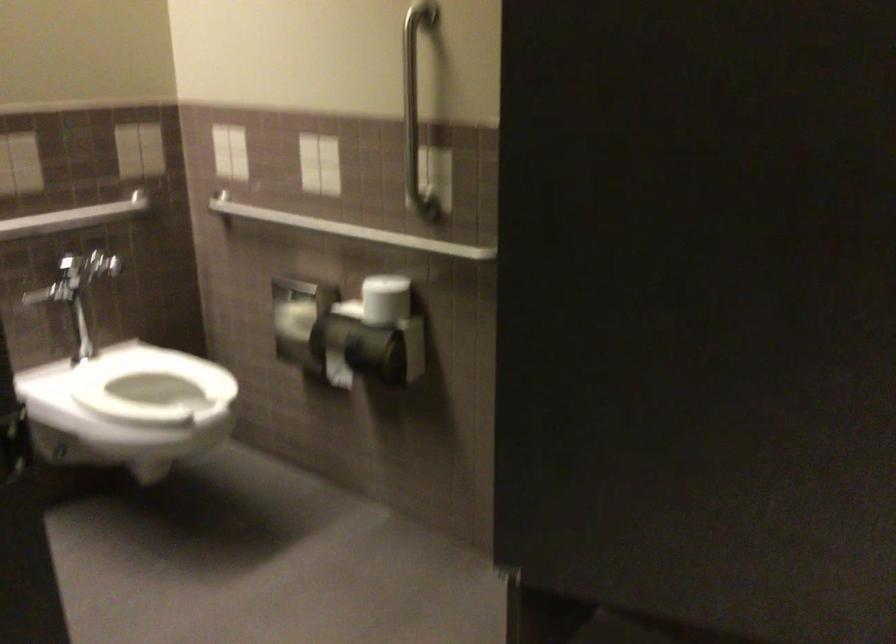
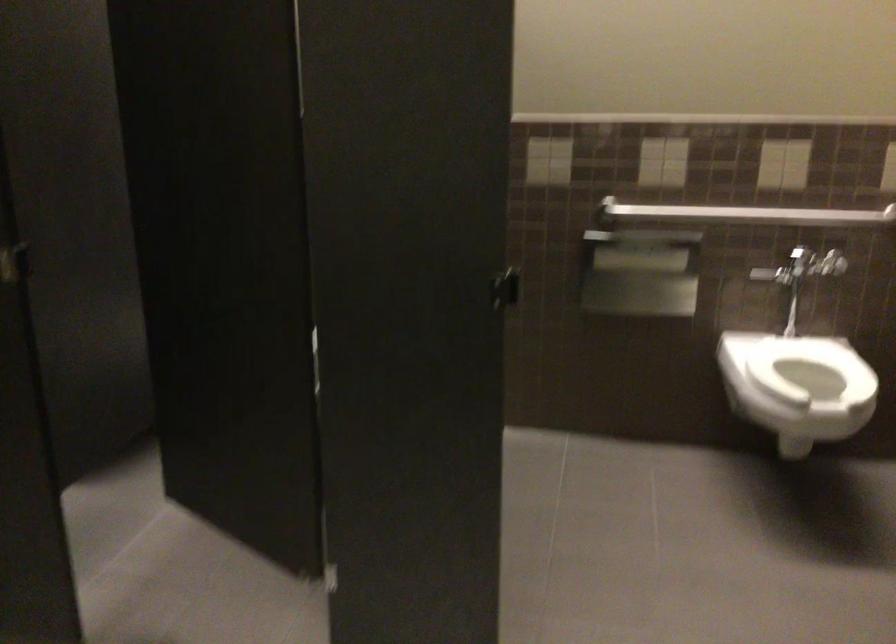
Find the pixel in the second image that matches point 134,389 in the first image.

(810, 368)